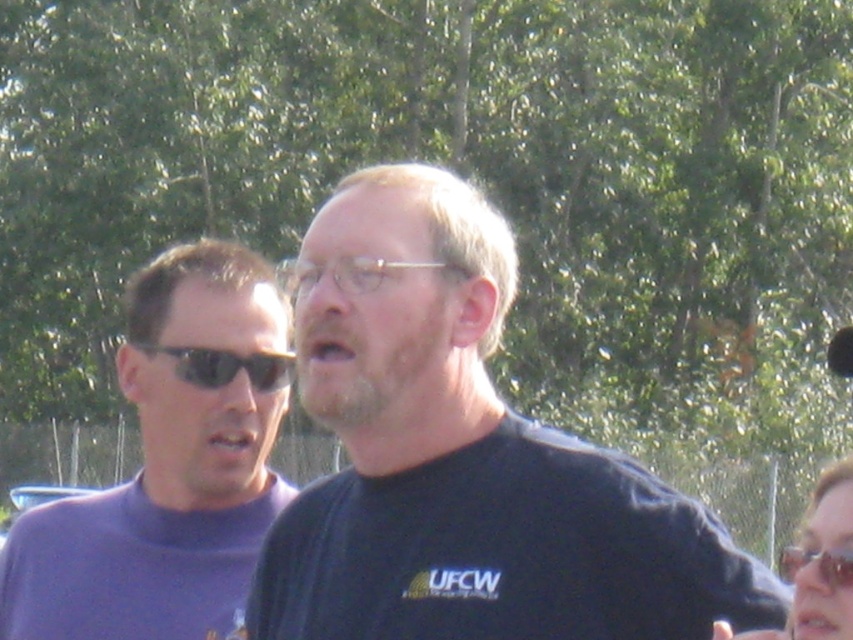
Based on the scene description, are the clear plastic glasses at center positioned higher than the clear plastic goggles at center?

Yes, the clear plastic glasses at center is above the clear plastic goggles at center, so it is positioned higher.

You are a photographer trying to capture a closeup of the sunglasses at upper right in the scene. Given their position, would you need to adjust your camera focus to ensure they are sharp in the photo?

The sunglasses at upper right are located at point 2D coordinates (817, 566), which is within the typical focus range of a camera lens. Therefore, adjusting the focus should allow them to be sharp in the photo.